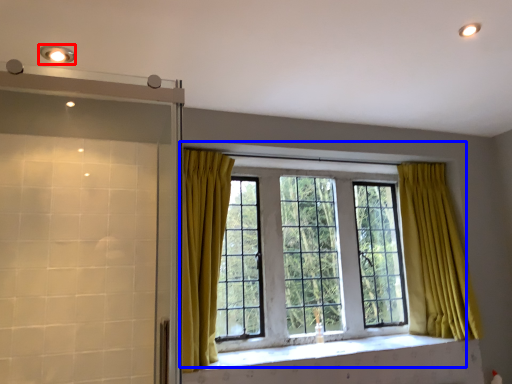
Question: Which object is closer to the camera taking this photo, light fixture (highlighted by a red box) or window (highlighted by a blue box)?

Choices:
 (A) light fixture
 (B) window

Answer: (A)